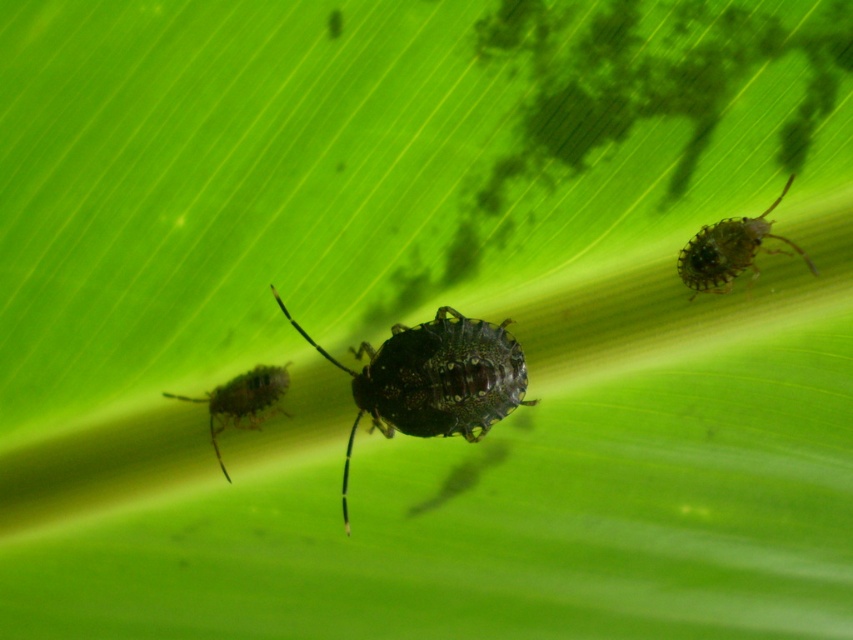
Is point (433, 328) in front of point (698, 253)?

That is False.

From the picture: Does shiny dark green bug at center have a lesser width compared to shiny dark green bug at upper right?

No, shiny dark green bug at center is not thinner than shiny dark green bug at upper right.

Which is in front, point (467, 342) or point (769, 227)?

Point (769, 227) is more forward.

What are the coordinates of `shiny dark green bug at center` in the screenshot? It's located at (432, 380).

Does shiny dark green bug at upper right have a lesser height compared to shiny brown bug at lower left?

Incorrect, shiny dark green bug at upper right's height does not fall short of shiny brown bug at lower left's.

Which is in front, point (694, 250) or point (248, 413)?

Point (694, 250) is more forward.

The height and width of the screenshot is (640, 853). In order to click on shiny dark green bug at upper right in this screenshot , I will do click(730, 250).

Is shiny dark green bug at center bigger than shiny brown bug at lower left?

Indeed, shiny dark green bug at center has a larger size compared to shiny brown bug at lower left.

Image resolution: width=853 pixels, height=640 pixels. What do you see at coordinates (432, 380) in the screenshot? I see `shiny dark green bug at center` at bounding box center [432, 380].

Locate an element on the screen. The image size is (853, 640). shiny dark green bug at center is located at coordinates (432, 380).